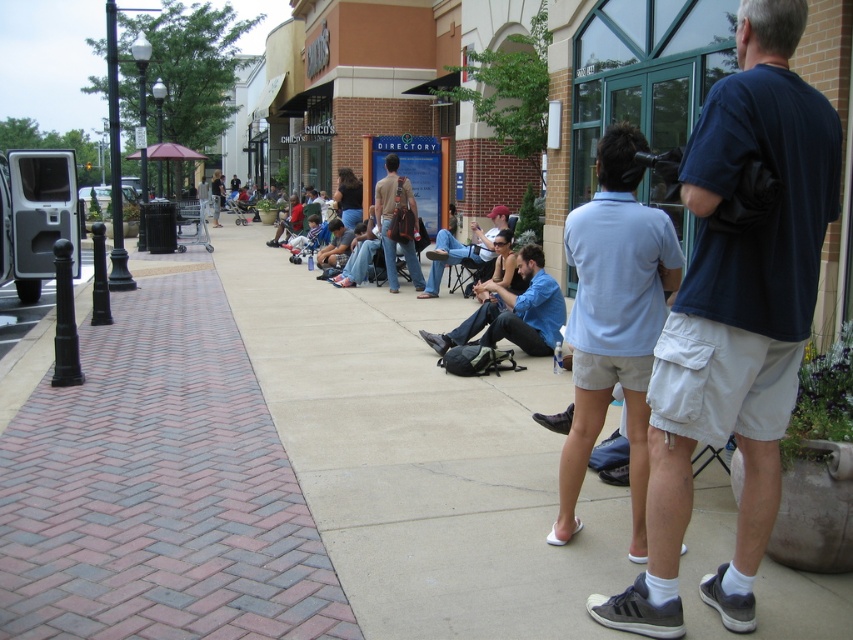
Question: Does concrete sidewalk at center have a smaller size compared to matte brown backpack at center?

Choices:
 (A) yes
 (B) no

Answer: (B)

Question: Which point is farther to the camera?

Choices:
 (A) 556,529
 (B) 607,512
 (C) 677,333

Answer: (B)

Question: Does concrete sidewalk at center appear under denim jeans at center?

Choices:
 (A) yes
 (B) no

Answer: (A)

Question: Which of the following is the farthest from the observer?

Choices:
 (A) denim jeans at center
 (B) matte brown backpack at center
 (C) concrete sidewalk at center

Answer: (B)

Question: Is concrete sidewalk at center behind dark blue t-shirt at center?

Choices:
 (A) no
 (B) yes

Answer: (B)

Question: Which is nearer to the matte brown backpack at center?

Choices:
 (A) dark blue t-shirt at center
 (B) light blue shirt at center
 (C) blue denim jeans at center
 (D) denim jeans at center

Answer: (D)